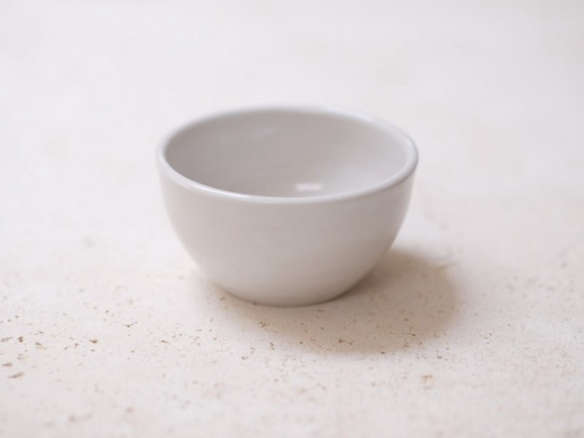
Find the location of `left side of cup`. left side of cup is located at coordinates (177, 228).